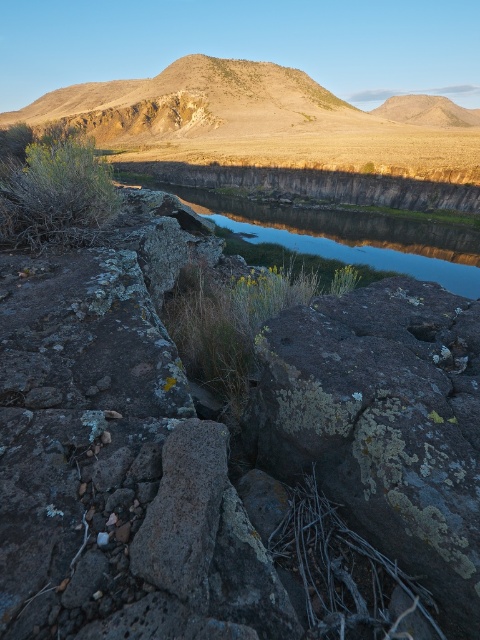
Does lichen-covered rock at center have a lesser height compared to smooth reflective water at center?

Correct, lichen-covered rock at center is not as tall as smooth reflective water at center.

Is lichen-covered rock at center positioned at the back of smooth reflective water at center?

No, it is in front of smooth reflective water at center.

Find the location of `lichen-covered rock at center`. lichen-covered rock at center is located at coordinates (383, 422).

Identify the location of lichen-covered rock at center. (383, 422).

Can you confirm if rugged brown mountain at upper center is positioned to the left of smooth reflective water at center?

Indeed, rugged brown mountain at upper center is positioned on the left side of smooth reflective water at center.

Who is higher up, rugged brown mountain at upper center or smooth reflective water at center?

rugged brown mountain at upper center is above.

Find the location of a particular element. rugged brown mountain at upper center is located at coordinates (264, 122).

Which is more to the right, lichen-covered rock at center or rugged brown mountain at upper center?

lichen-covered rock at center is more to the right.

Does point (421, 449) come in front of point (204, 113)?

Yes, it is.

Where is `lichen-covered rock at center`? The width and height of the screenshot is (480, 640). lichen-covered rock at center is located at coordinates (383, 422).